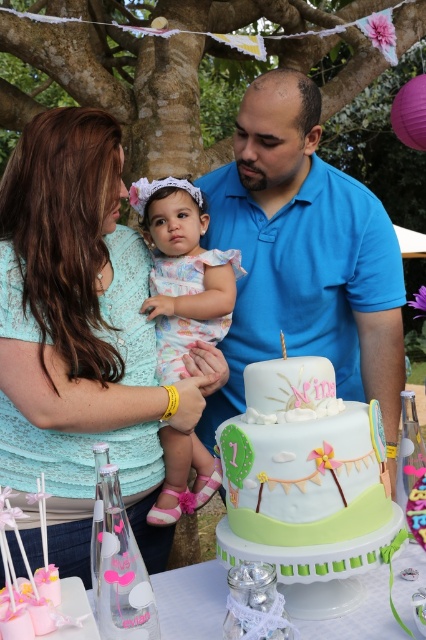
Question: Estimate the real-world distances between objects in this image. Which object is farther from the blue smooth shirt at center?

Choices:
 (A) pastel fondant cake at center
 (B) pastel floral dress at center
 (C) matte teal lace dress at upper left

Answer: (A)

Question: Does blue smooth shirt at center come behind pastel fondant cake at center?

Choices:
 (A) no
 (B) yes

Answer: (B)

Question: Which point is farther to the camera?

Choices:
 (A) (316, 324)
 (B) (249, 388)
 (C) (169, 266)
 (D) (5, 221)

Answer: (A)

Question: In this image, where is pastel fondant cake at center located relative to pastel floral dress at center?

Choices:
 (A) above
 (B) below

Answer: (B)

Question: Is matte teal lace dress at upper left above blue smooth shirt at center?

Choices:
 (A) no
 (B) yes

Answer: (A)

Question: Which of these objects is positioned closest to the pastel floral dress at center?

Choices:
 (A) matte teal lace dress at upper left
 (B) pastel fondant cake at center

Answer: (A)